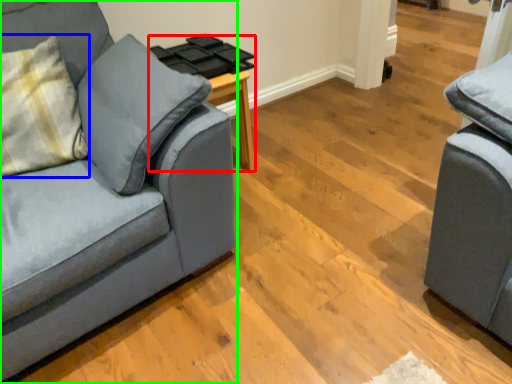
Question: Considering the real-world distances, which object is closest to side table (highlighted by a red box)? throw pillow (highlighted by a blue box) or studio couch (highlighted by a green box).

Choices:
 (A) throw pillow
 (B) studio couch

Answer: (A)